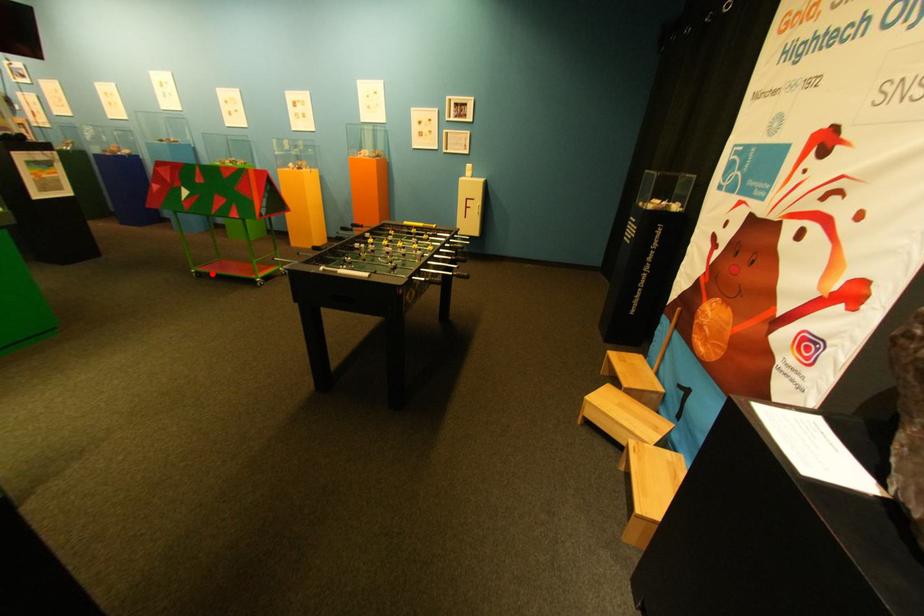
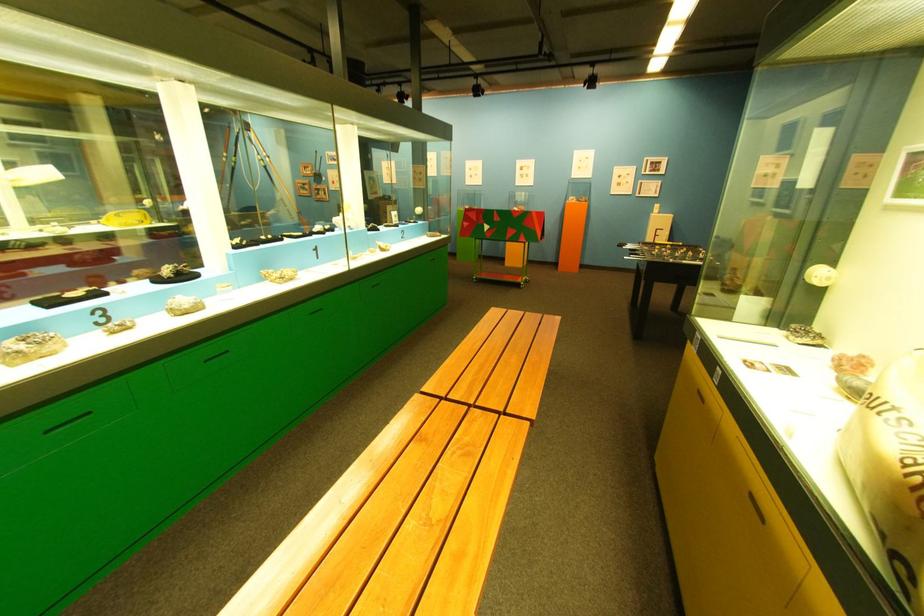
Where in the second image is the point corresponding to the highlighted location from the first image?

(492, 281)